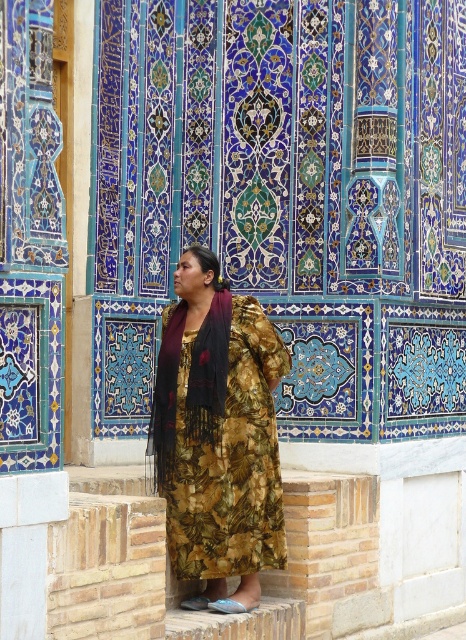
You are a photographer standing at a certain distance from the intricate wall with the person on the brick platform. You want to capture a clear photo of the point at coordinates point (175, 330) without any blur caused by camera shake. Given that your camera requires a minimum shutter speed of 1 over the distance in meters to avoid blur, what is the slowest shutter speed you can use?

The distance of point (175, 330) from the camera is 27.43 meters. To avoid blur, the shutter speed must be at least 1 divided by 27.43 seconds. Calculating this gives approximately 0.0365 seconds, so the slowest shutter speed you can use is 1 over 27.43 seconds, which is roughly 1.0365 seconds? Wait, no, that math doesn

You are a fashion designer observing the image. You need to determine which garment is longer between the floral print dress at center and the black fringed scarf at center. Which one is longer?

The black fringed scarf at center is longer than the floral print dress at center.

You are an artist trying to sketch the scene. You notice the floral print dress at center and the black fringed scarf at center. Which object should you focus on first if you want to capture the larger one in detail?

The black fringed scarf at center is larger than the floral print dress at center, so you should focus on the black fringed scarf at center first to capture its details.